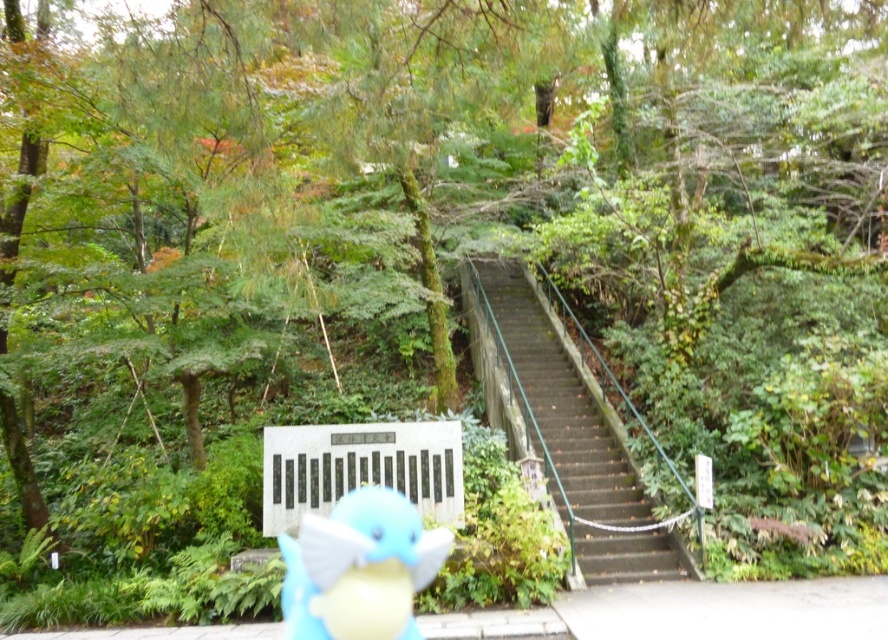
Which is below, dark gray concrete stairs at center or blue plush toy at center?

blue plush toy at center

The width and height of the screenshot is (888, 640). What do you see at coordinates (563, 429) in the screenshot?
I see `dark gray concrete stairs at center` at bounding box center [563, 429].

Locate an element on the screen. dark gray concrete stairs at center is located at coordinates (563, 429).